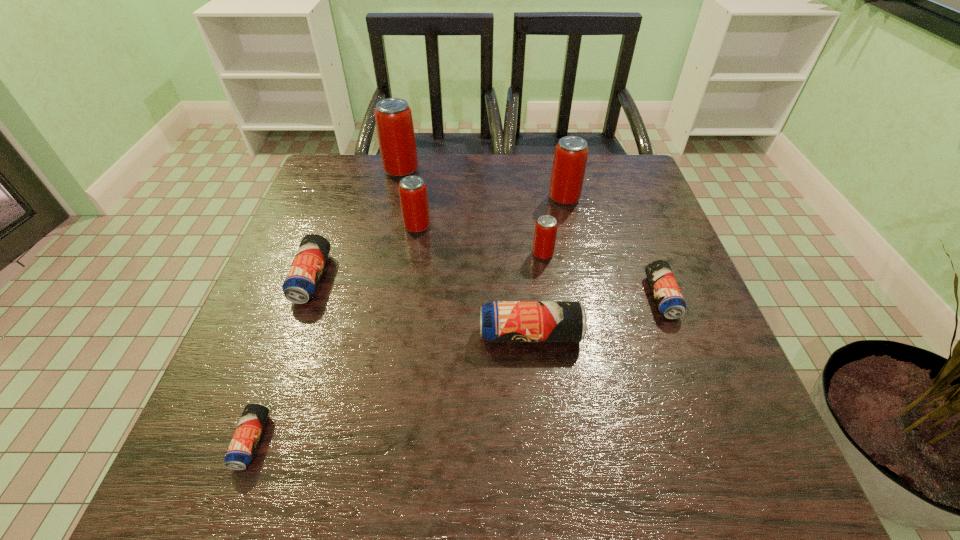
Find the location of a particular element. the third shortest beer can is located at coordinates (303, 277).

Where is `the sixth tallest object`? the sixth tallest object is located at coordinates (303, 277).

At what (x,y) coordinates should I click in order to perform the action: click on the rightmost beer can. Please return your answer as a coordinate pair (x, y). Looking at the image, I should click on (669, 299).

The width and height of the screenshot is (960, 540). What are the coordinates of `the second shortest beer can` in the screenshot? It's located at (669, 299).

Identify the location of the nearest beer can. (241, 450).

Locate an element on the screen. the shortest beer can is located at coordinates (241, 450).

This screenshot has height=540, width=960. I want to click on blank area located on the right of the farthest object, so click(515, 170).

Where is `vacant space situated on the back of the rightmost pink beer can`? The height and width of the screenshot is (540, 960). vacant space situated on the back of the rightmost pink beer can is located at coordinates (557, 167).

Identify the location of free region located on the back of the third farthest pink beer can. (421, 199).

Locate an element on the screen. The width and height of the screenshot is (960, 540). vacant space located on the front of the second pink beer can from right to left is located at coordinates (561, 379).